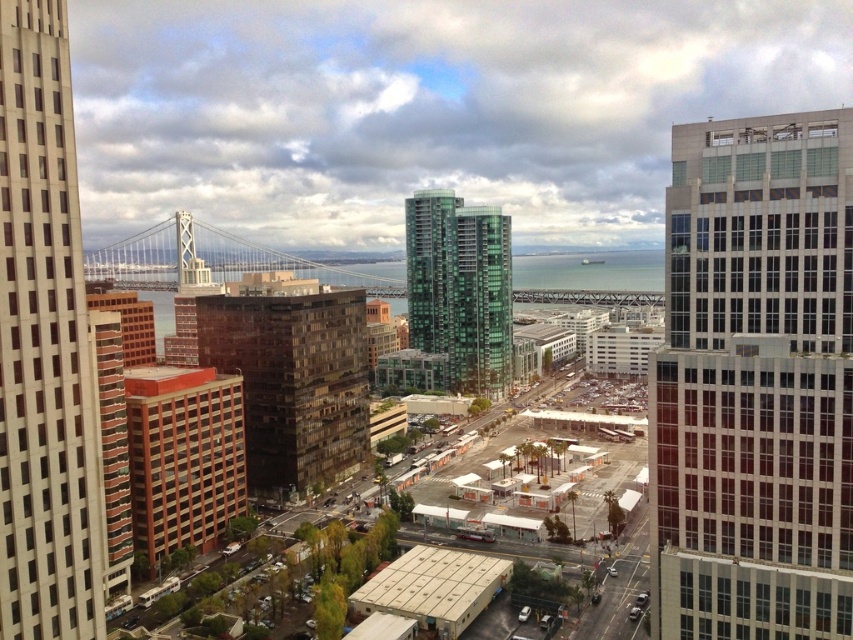
Question: Does white glass skyscraper at left have a larger size compared to brown glass building at center?

Choices:
 (A) no
 (B) yes

Answer: (B)

Question: Considering the relative positions of glassy reflective skyscraper at right and brown brick building at lower left in the image provided, where is glassy reflective skyscraper at right located with respect to brown brick building at lower left?

Choices:
 (A) below
 (B) above

Answer: (B)

Question: Which is nearer to the glassy reflective skyscraper at right?

Choices:
 (A) brown glass building at center
 (B) brown brick building at lower left

Answer: (A)

Question: Which object is the closest to the glassy reflective skyscraper at right?

Choices:
 (A) brown glass building at center
 (B) brown brick building at lower left
 (C) brick textured building at left

Answer: (C)

Question: Which of the following is the farthest from the observer?

Choices:
 (A) (845, 259)
 (B) (102, 429)
 (C) (496, 240)
 (D) (281, 317)

Answer: (C)

Question: Is the position of brown glass building at center more distant than that of metallic gray bridge at center-left?

Choices:
 (A) no
 (B) yes

Answer: (A)